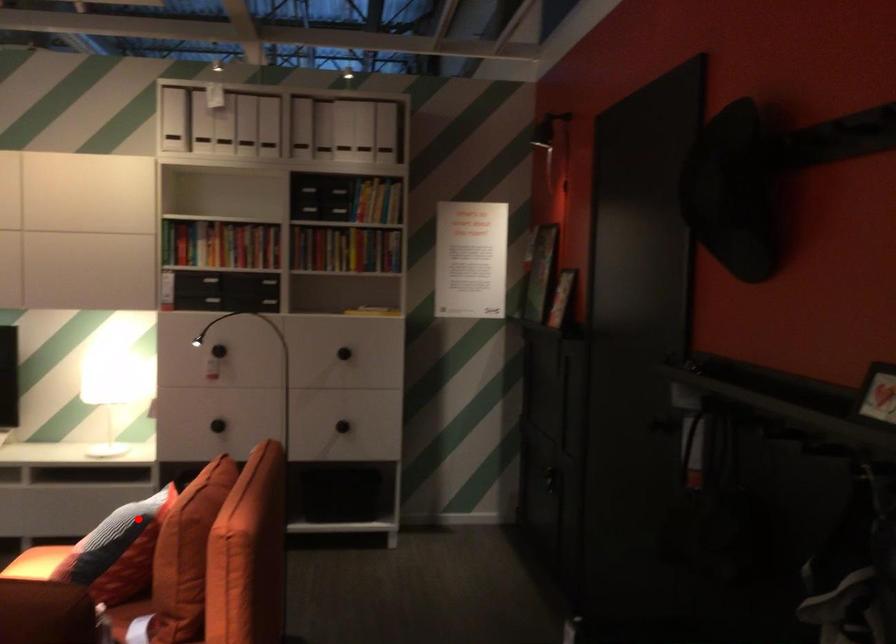
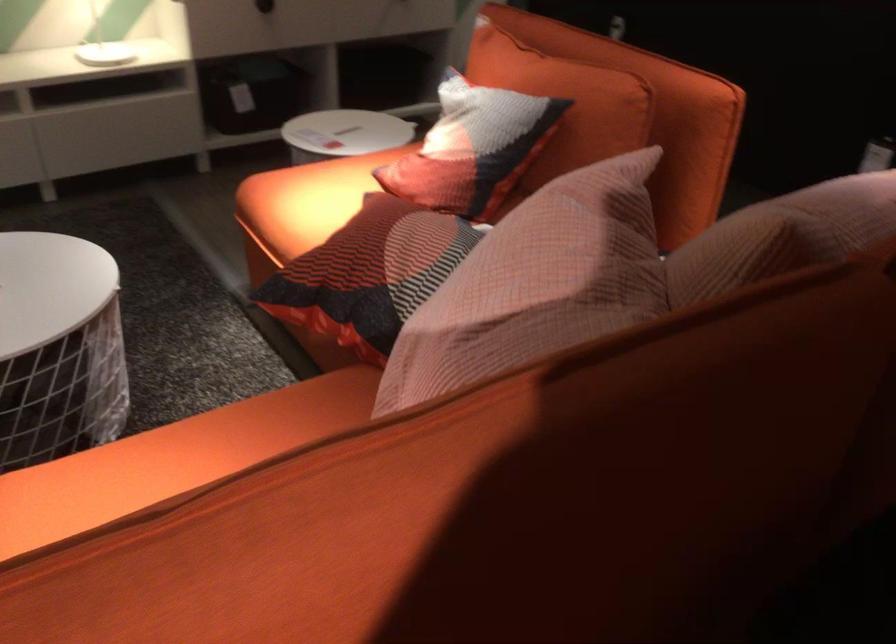
Question: A red point is marked in image1. In image2, is the corresponding 3D point closer to the camera or farther? Reply with the corresponding letter.

Choices:
 (A) The corresponding 3D point is closer.
 (B) The corresponding 3D point is farther.

Answer: (A)